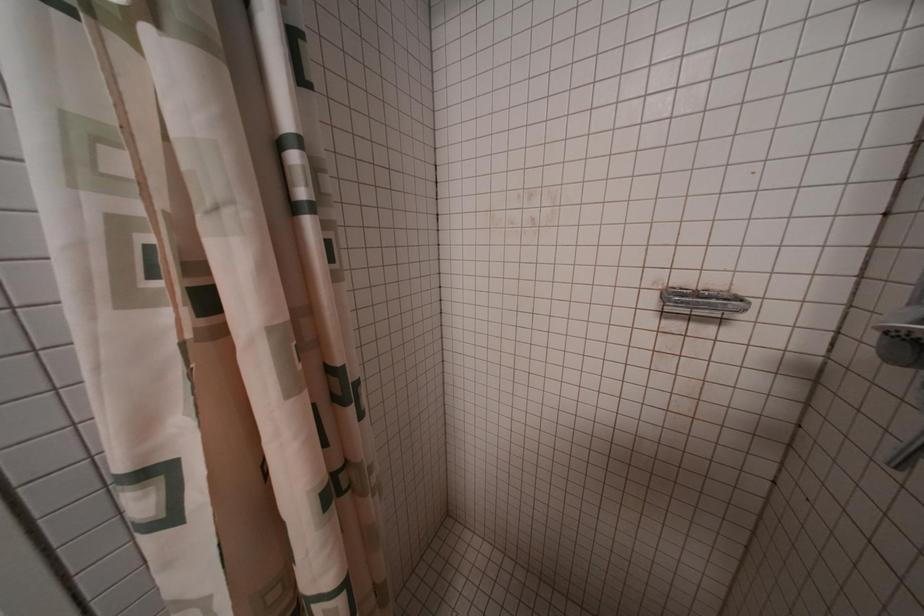
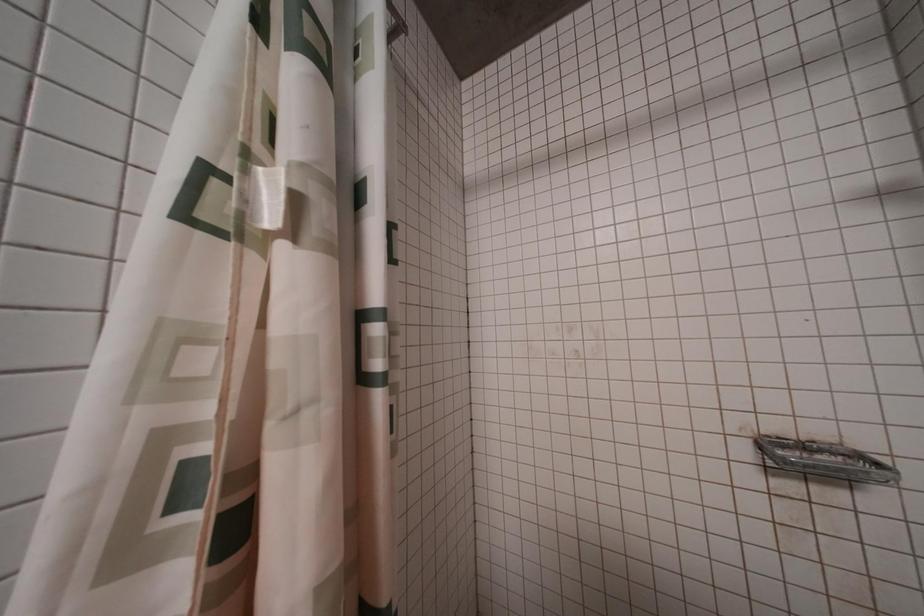
Question: In a continuous first-person perspective shot, in which direction is the camera moving?

Choices:
 (A) Left
 (B) Right
 (C) Forward
 (D) Backward

Answer: (A)